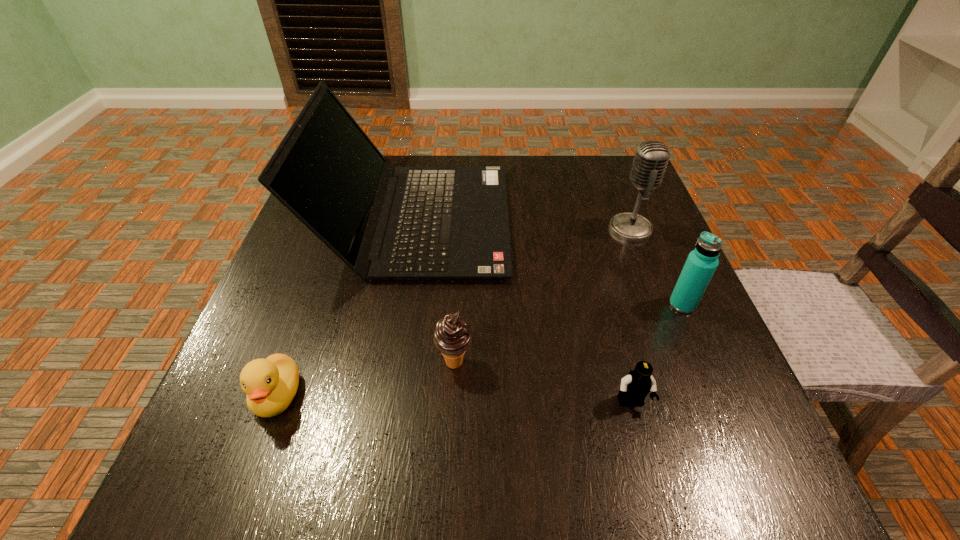
At what (x,y) coordinates should I click in order to perform the action: click on free space between the Lego and the duckling. Please return your answer as a coordinate pair (x, y). The image size is (960, 540). Looking at the image, I should click on (454, 399).

Where is `empty location between the duckling and the laptop computer`? empty location between the duckling and the laptop computer is located at coordinates (347, 308).

Identify the location of vacant area that lies between the Lego and the laptop computer. This screenshot has height=540, width=960. (523, 312).

This screenshot has height=540, width=960. Find the location of `free spot between the third shortest object and the microphone`. free spot between the third shortest object and the microphone is located at coordinates (542, 295).

The height and width of the screenshot is (540, 960). I want to click on vacant space that's between the icecream and the microphone, so click(x=542, y=295).

The image size is (960, 540). What are the coordinates of `vacant area between the third object from right to left and the second tallest object` in the screenshot? It's located at pyautogui.click(x=631, y=316).

Point out which object is positioned as the second nearest to the fourth object from left to right. Please provide its 2D coordinates. Your answer should be formatted as a tuple, i.e. [(x, y)], where the tuple contains the x and y coordinates of a point satisfying the conditions above.

[(452, 336)]

Identify which object is the second nearest to the microphone. Please provide its 2D coordinates. Your answer should be formatted as a tuple, i.e. [(x, y)], where the tuple contains the x and y coordinates of a point satisfying the conditions above.

[(413, 223)]

Find the location of a particular element. The image size is (960, 540). vacant space that satisfies the following two spatial constraints: 1. on the front side of the fourth nearest object; 2. on the right side of the microphone is located at coordinates (660, 305).

Where is `vacant region that satisfies the following two spatial constraints: 1. on the screen of the water bottle; 2. on the left side of the laptop computer`? The image size is (960, 540). vacant region that satisfies the following two spatial constraints: 1. on the screen of the water bottle; 2. on the left side of the laptop computer is located at coordinates (402, 305).